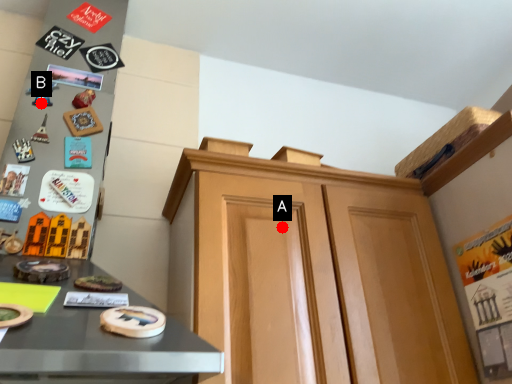
Question: Two points are circled on the image, labeled by A and B beside each circle. Which point appears closest to the camera in this image?

Choices:
 (A) A is closer
 (B) B is closer

Answer: (A)